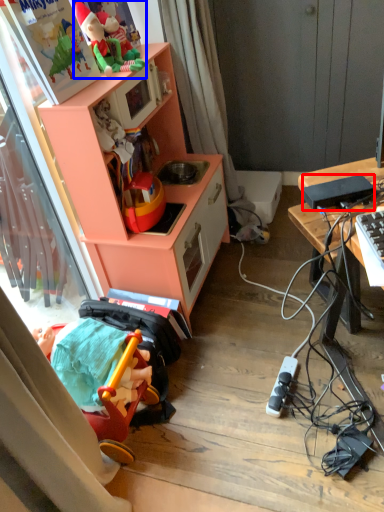
Question: Which of the following is the farthest to the observer, appliance (highlighted by a red box) or toy (highlighted by a blue box)?

Choices:
 (A) appliance
 (B) toy

Answer: (B)